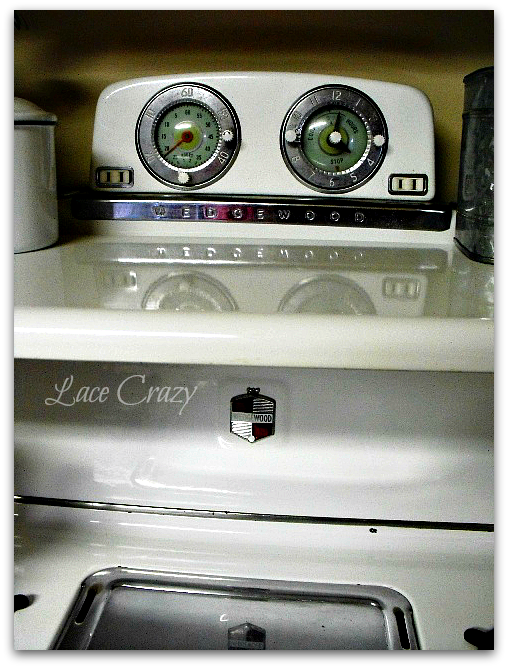
Where is `silver pot`? The width and height of the screenshot is (508, 668). silver pot is located at coordinates (479, 174).